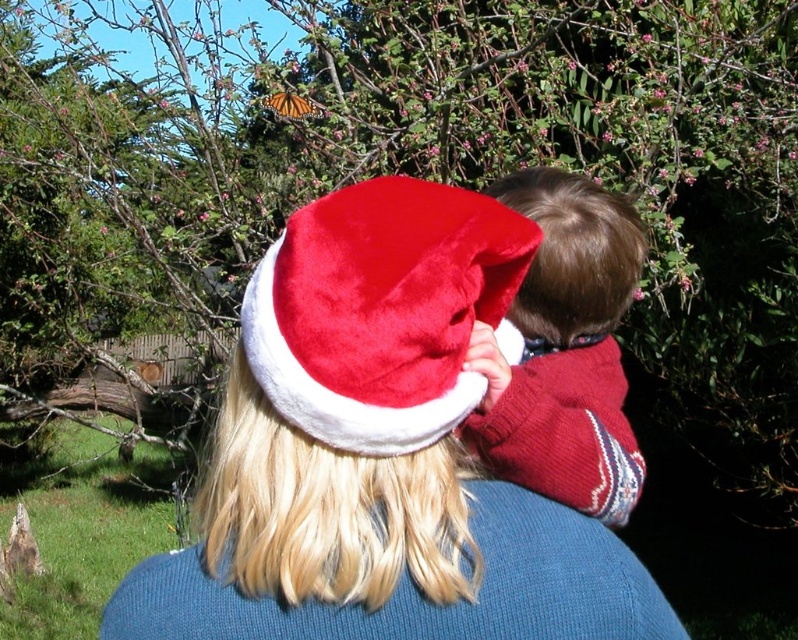
Which is in front, point (365, 193) or point (581, 344)?

Point (365, 193)

Where is `velvet red santa hat at center`? The width and height of the screenshot is (798, 640). velvet red santa hat at center is located at coordinates (382, 310).

Where is `velvet red santa hat at center`? The height and width of the screenshot is (640, 798). velvet red santa hat at center is located at coordinates (382, 310).

Between point (433, 408) and point (275, 106), which one is positioned behind?

The point (275, 106) is behind.

I want to click on velvet red santa hat at center, so click(382, 310).

Can you confirm if velvet santa hat at center is wider than orange translucent butterfly at upper center?

Indeed, velvet santa hat at center has a greater width compared to orange translucent butterfly at upper center.

Measure the distance between velvet santa hat at center and camera.

They are 32.77 inches apart.

Image resolution: width=798 pixels, height=640 pixels. What are the coordinates of `velvet santa hat at center` in the screenshot? It's located at (382, 449).